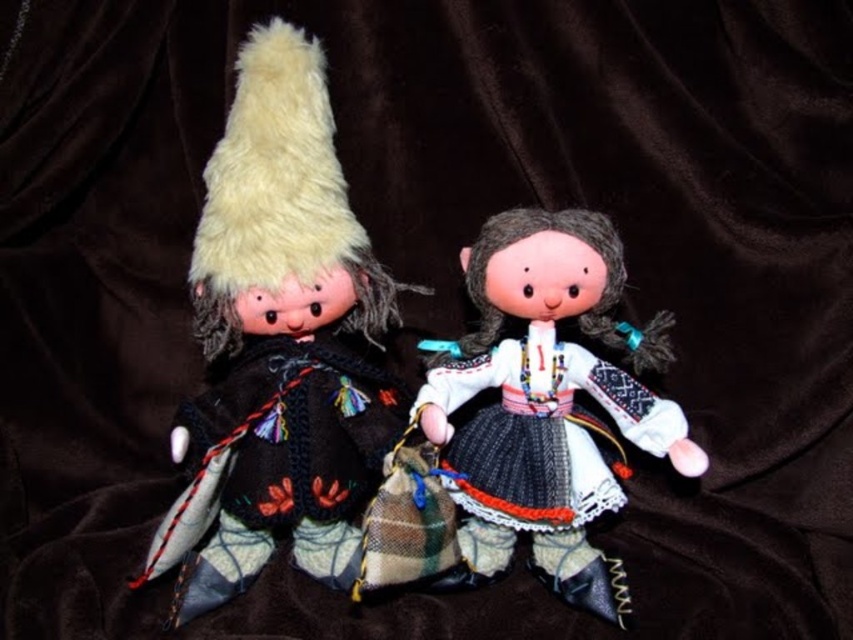
You are standing in front of the dolls and want to reach out to touch both points. Which point, point (451, 481) or point (341, 474), will require you to reach further back?

Point (341, 474) will require you to reach further back because it is positioned behind point (451, 481).